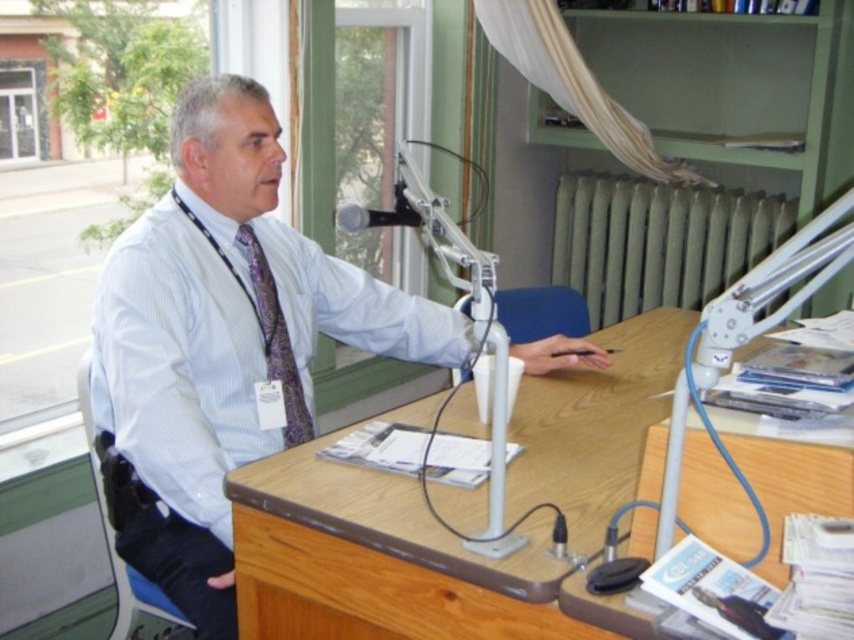
Which is below, white shirt at center or black leather chair at left?

black leather chair at left

Can you confirm if white shirt at center is positioned to the right of black leather chair at left?

Yes, white shirt at center is to the right of black leather chair at left.

The width and height of the screenshot is (854, 640). I want to click on white shirt at center, so click(221, 342).

At what (x,y) coordinates should I click in order to perform the action: click on wooden desk at center. Please return your answer as a coordinate pair (x, y). Image resolution: width=854 pixels, height=640 pixels. Looking at the image, I should click on (377, 561).

Is point (530, 444) less distant than point (164, 618)?

Yes, it is.

Between point (308, 502) and point (85, 424), which one is positioned behind?

The point (85, 424) is behind.

Find the location of `wooden desk at center`. wooden desk at center is located at coordinates 377,561.

Does white shirt at center appear over wooden desk at center?

Correct, white shirt at center is located above wooden desk at center.

Image resolution: width=854 pixels, height=640 pixels. Find the location of `white shirt at center`. white shirt at center is located at coordinates (221, 342).

The height and width of the screenshot is (640, 854). Describe the element at coordinates (221, 342) in the screenshot. I see `white shirt at center` at that location.

Identify the location of white shirt at center. This screenshot has width=854, height=640. (221, 342).